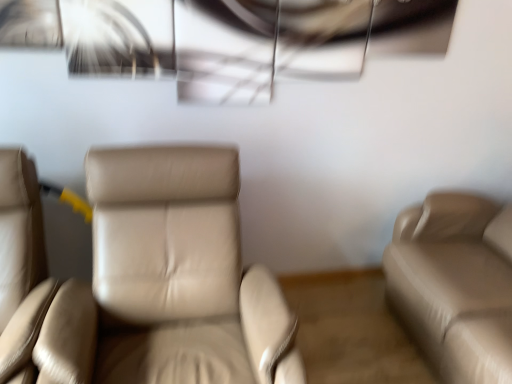
Measure the distance between beige leather chair at left, acting as the second chair starting from the right, and camera.

beige leather chair at left, acting as the second chair starting from the right, is 1.08 meters away from camera.

The height and width of the screenshot is (384, 512). What do you see at coordinates (456, 284) in the screenshot? I see `beige leather couch at right` at bounding box center [456, 284].

Where is `beige leather chair at center, arranged as the 2th chair when viewed from the left`? This screenshot has height=384, width=512. beige leather chair at center, arranged as the 2th chair when viewed from the left is located at coordinates (181, 273).

You are a GUI agent. You are given a task and a screenshot of the screen. Output one action in this format:
    pyautogui.click(x=<x>, y=<y>)
    Task: Click on the beige leather chair at left, acting as the second chair starting from the right
    The width and height of the screenshot is (512, 384).
    Given the screenshot: What is the action you would take?
    pyautogui.click(x=21, y=264)

Can you see beige leather chair at left, acting as the second chair starting from the right, touching beige leather chair at center, marked as the 1th chair in a right-to-left arrangement?

beige leather chair at left, acting as the second chair starting from the right, and beige leather chair at center, marked as the 1th chair in a right-to-left arrangement, are not in contact.

Where is `chair that appears below the beige leather chair at left, which is the 1th chair from left to right (from a real-world perspective)`? chair that appears below the beige leather chair at left, which is the 1th chair from left to right (from a real-world perspective) is located at coordinates (181, 273).

Which object is thinner, beige leather chair at left, acting as the second chair starting from the right, or beige leather chair at center, arranged as the 2th chair when viewed from the left?

beige leather chair at left, acting as the second chair starting from the right.

In the scene shown: From a real-world perspective, who is located higher, beige leather chair at left, acting as the second chair starting from the right, or beige leather chair at center, marked as the 1th chair in a right-to-left arrangement?

beige leather chair at left, acting as the second chair starting from the right, is physically above.

From a real-world perspective, is beige leather chair at left, which is the 1th chair from left to right, located beneath beige leather couch at right?

Correct, in the physical world, beige leather chair at left, which is the 1th chair from left to right, is lower than beige leather couch at right.

From the image's perspective, which one is positioned higher, beige leather chair at left, which is the 1th chair from left to right, or beige leather couch at right?

beige leather couch at right.

Considering the relative sizes of beige leather chair at left, acting as the second chair starting from the right, and beige leather couch at right in the image provided, is beige leather chair at left, acting as the second chair starting from the right, shorter than beige leather couch at right?

No, beige leather chair at left, acting as the second chair starting from the right, is not shorter than beige leather couch at right.

Is beige leather couch at right located within beige leather chair at left, which is the 1th chair from left to right?

No, beige leather chair at left, which is the 1th chair from left to right, does not contain beige leather couch at right.

Can you confirm if beige leather couch at right is positioned to the left of beige leather chair at left, acting as the second chair starting from the right?

Incorrect, beige leather couch at right is not on the left side of beige leather chair at left, acting as the second chair starting from the right.

Do you think beige leather couch at right is within beige leather chair at left, which is the 1th chair from left to right, or outside of it?

beige leather couch at right cannot be found inside beige leather chair at left, which is the 1th chair from left to right.

From the image's perspective, between beige leather couch at right and beige leather chair at left, acting as the second chair starting from the right, which one is located above?

beige leather couch at right is shown above in the image.

Looking at their sizes, would you say beige leather chair at center, marked as the 1th chair in a right-to-left arrangement, is wider or thinner than beige leather chair at left, acting as the second chair starting from the right?

Considering their sizes, beige leather chair at center, marked as the 1th chair in a right-to-left arrangement, looks broader than beige leather chair at left, acting as the second chair starting from the right.

Is beige leather chair at center, arranged as the 2th chair when viewed from the left, inside or outside of beige leather chair at left, which is the 1th chair from left to right?

beige leather chair at center, arranged as the 2th chair when viewed from the left, is not inside beige leather chair at left, which is the 1th chair from left to right, it's outside.

From the image's perspective, which one is positioned higher, beige leather chair at center, arranged as the 2th chair when viewed from the left, or beige leather chair at left, acting as the second chair starting from the right?

beige leather chair at center, arranged as the 2th chair when viewed from the left, appears higher in the image.

What's the angular difference between beige leather chair at center, marked as the 1th chair in a right-to-left arrangement, and beige leather chair at left, which is the 1th chair from left to right,'s facing directions?

0.00055 degrees.

From the picture: Considering the sizes of objects beige leather couch at right and beige leather chair at center, marked as the 1th chair in a right-to-left arrangement, in the image provided, who is wider, beige leather couch at right or beige leather chair at center, marked as the 1th chair in a right-to-left arrangement,?

beige leather couch at right is wider.

From the image's perspective, is beige leather couch at right beneath beige leather chair at center, arranged as the 2th chair when viewed from the left?

No.

Image resolution: width=512 pixels, height=384 pixels. Identify the location of studio couch that appears above the beige leather chair at center, arranged as the 2th chair when viewed from the left (from the image's perspective). (456, 284).

Considering their positions, is beige leather couch at right located in front of or behind beige leather chair at center, arranged as the 2th chair when viewed from the left?

beige leather couch at right is behind beige leather chair at center, arranged as the 2th chair when viewed from the left.

Considering the sizes of objects beige leather chair at center, arranged as the 2th chair when viewed from the left, and beige leather couch at right in the image provided, who is smaller, beige leather chair at center, arranged as the 2th chair when viewed from the left, or beige leather couch at right?

With smaller size is beige leather chair at center, arranged as the 2th chair when viewed from the left.

Is beige leather chair at center, marked as the 1th chair in a right-to-left arrangement, not within beige leather couch at right?

Yes.

Where is `the 1st chair to the left of the beige leather couch at right, starting your count from the anchor`? the 1st chair to the left of the beige leather couch at right, starting your count from the anchor is located at coordinates (181, 273).

From the image's perspective, which one is positioned lower, beige leather chair at center, marked as the 1th chair in a right-to-left arrangement, or beige leather couch at right?

beige leather chair at center, marked as the 1th chair in a right-to-left arrangement, from the image's perspective.

This screenshot has height=384, width=512. Identify the location of chair behind the beige leather chair at center, marked as the 1th chair in a right-to-left arrangement. (21, 264).

I want to click on the 1st chair in front of the beige leather couch at right, so click(21, 264).

Considering their positions, is beige leather chair at center, marked as the 1th chair in a right-to-left arrangement, positioned closer to beige leather couch at right than beige leather chair at left, acting as the second chair starting from the right?

beige leather chair at center, marked as the 1th chair in a right-to-left arrangement, is positioned closer to the anchor beige leather couch at right.

When comparing their distances from beige leather chair at center, arranged as the 2th chair when viewed from the left, does beige leather chair at left, acting as the second chair starting from the right, or beige leather couch at right seem closer?

Based on the image, beige leather chair at left, acting as the second chair starting from the right, appears to be nearer to beige leather chair at center, arranged as the 2th chair when viewed from the left.

Which object lies nearer to the anchor point beige leather chair at center, marked as the 1th chair in a right-to-left arrangement, beige leather couch at right or beige leather chair at left, which is the 1th chair from left to right?

beige leather chair at left, which is the 1th chair from left to right, is positioned closer to the anchor beige leather chair at center, marked as the 1th chair in a right-to-left arrangement.

Considering their positions, is beige leather chair at left, acting as the second chair starting from the right, positioned closer to beige leather couch at right than beige leather chair at center, arranged as the 2th chair when viewed from the left?

Based on the image, beige leather chair at center, arranged as the 2th chair when viewed from the left, appears to be nearer to beige leather couch at right.

When comparing their distances from beige leather chair at left, acting as the second chair starting from the right, does beige leather couch at right or beige leather chair at center, marked as the 1th chair in a right-to-left arrangement, seem further?

beige leather couch at right is further to beige leather chair at left, acting as the second chair starting from the right.

Which object lies further to the anchor point beige leather chair at left, acting as the second chair starting from the right, beige leather chair at center, marked as the 1th chair in a right-to-left arrangement, or beige leather couch at right?

beige leather couch at right lies further to beige leather chair at left, acting as the second chair starting from the right, than the other object.

Where is `chair between beige leather chair at left, which is the 1th chair from left to right, and beige leather couch at right, in the horizontal direction`? The width and height of the screenshot is (512, 384). chair between beige leather chair at left, which is the 1th chair from left to right, and beige leather couch at right, in the horizontal direction is located at coordinates (181, 273).